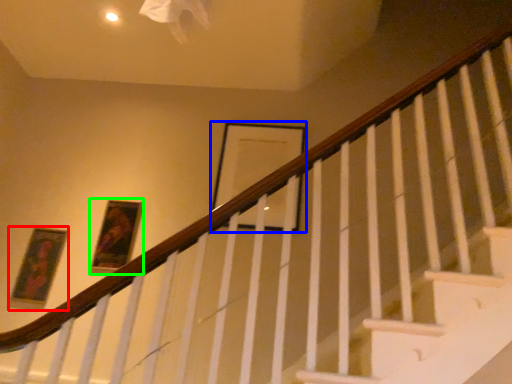
Question: Which object is the farthest from picture frame (highlighted by a red box)? Choose among these: picture frame (highlighted by a blue box) or picture frame (highlighted by a green box).

Choices:
 (A) picture frame
 (B) picture frame

Answer: (A)